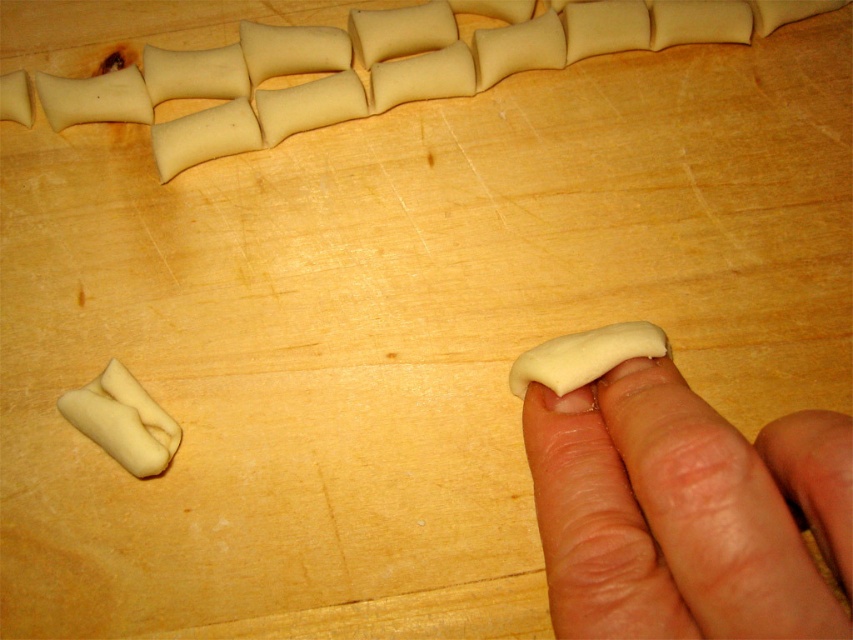
Can you confirm if smooth flesh at center is positioned to the right of white dough at upper center?

Correct, you'll find smooth flesh at center to the right of white dough at upper center.

Is point (566, 488) farther from viewer compared to point (91, 113)?

That is False.

Locate an element on the screen. Image resolution: width=853 pixels, height=640 pixels. smooth flesh at center is located at coordinates (685, 512).

Does white dough at upper center have a greater height compared to white dough at lower right?

Correct, white dough at upper center is much taller as white dough at lower right.

Does point (496, 1) lie behind point (602, 356)?

That is True.

This screenshot has height=640, width=853. What are the coordinates of `white dough at upper center` in the screenshot? It's located at (383, 65).

Does white dough at upper center have a lesser width compared to white dough at center?

No.

Does white dough at upper center appear on the right side of white dough at center?

Yes, white dough at upper center is to the right of white dough at center.

At what (x,y) coordinates should I click in order to perform the action: click on white dough at upper center. Please return your answer as a coordinate pair (x, y). This screenshot has height=640, width=853. Looking at the image, I should click on [x=383, y=65].

Image resolution: width=853 pixels, height=640 pixels. Find the location of `white dough at upper center`. white dough at upper center is located at coordinates (383, 65).